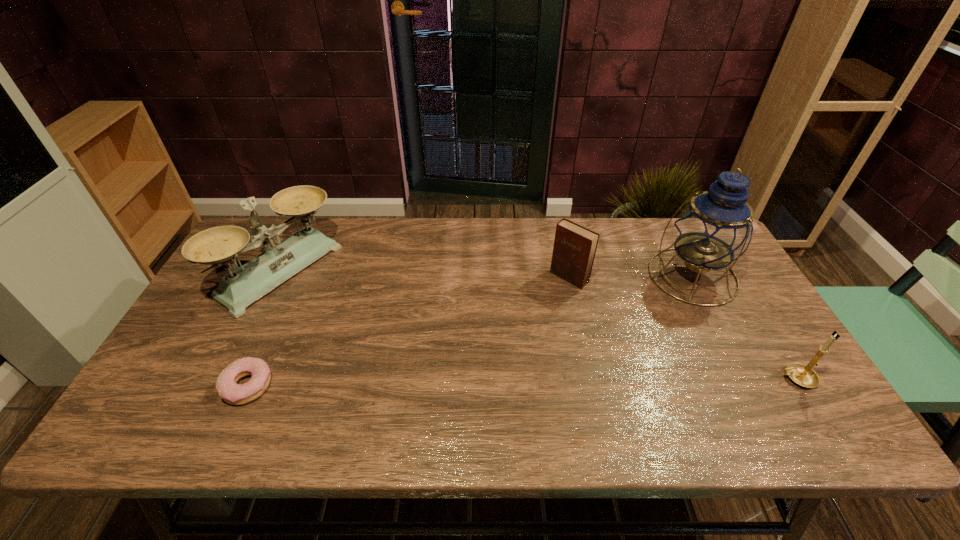
You are a GUI agent. You are given a task and a screenshot of the screen. Output one action in this format:
    pyautogui.click(x=<x>, y=<y>)
    Task: Click on the vacant space on the desktop that is between the doughnut and the candle holder and is positioned on the front cover of the diary
    
    Given the screenshot: What is the action you would take?
    pyautogui.click(x=454, y=383)

Locate an element on the screen. The width and height of the screenshot is (960, 540). free space on the desktop that is between the doughnut and the candle holder and is positioned on the front-facing side of the tallest object is located at coordinates (529, 382).

This screenshot has width=960, height=540. Find the location of `free spot on the desktop that is between the doughnut and the candle holder and is positioned on the front-facing side of the scale`. free spot on the desktop that is between the doughnut and the candle holder and is positioned on the front-facing side of the scale is located at coordinates (462, 383).